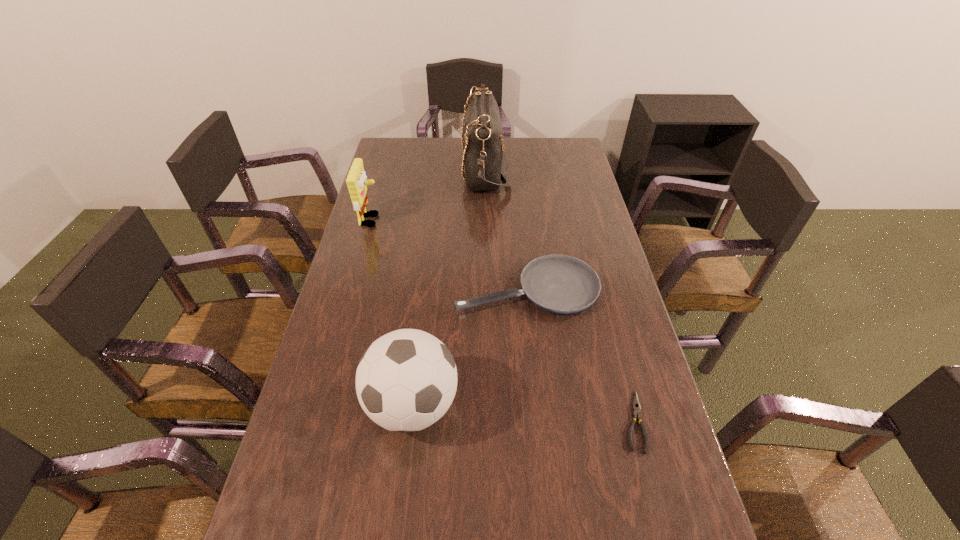
At what (x,y) coordinates should I click in order to perform the action: click on vacant space that satisfies the following two spatial constraints: 1. on the face of the pliers; 2. on the left side of the leftmost object. Please return your answer as a coordinate pair (x, y). The image size is (960, 540). Looking at the image, I should click on (315, 421).

What are the coordinates of `free region that satisfies the following two spatial constraints: 1. on the face of the sponge; 2. on the left side of the shortest object` in the screenshot? It's located at (315, 421).

Find the location of a particular element. The width and height of the screenshot is (960, 540). vacant space that satisfies the following two spatial constraints: 1. at the front of the handbag with chain and zipper; 2. on the front side of the soccer ball is located at coordinates (489, 405).

Where is `free space that satisfies the following two spatial constraints: 1. at the front of the pliers with chain and zipper; 2. on the left side of the tallest object`? This screenshot has width=960, height=540. free space that satisfies the following two spatial constraints: 1. at the front of the pliers with chain and zipper; 2. on the left side of the tallest object is located at coordinates (490, 421).

Locate an element on the screen. Image resolution: width=960 pixels, height=540 pixels. free space that satisfies the following two spatial constraints: 1. at the front of the tallest object with chain and zipper; 2. on the back side of the frying pan is located at coordinates (487, 288).

You are a GUI agent. You are given a task and a screenshot of the screen. Output one action in this format:
    pyautogui.click(x=<x>, y=<y>)
    Task: Click on the vacant space that satisfies the following two spatial constraints: 1. at the front of the tallest object with chain and zipper; 2. on the left side of the shortest object
    This screenshot has height=540, width=960.
    Given the screenshot: What is the action you would take?
    pyautogui.click(x=490, y=421)